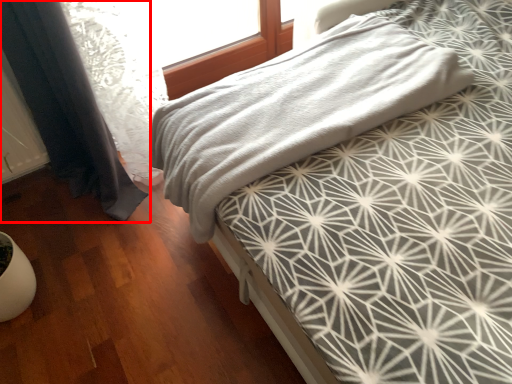
Question: From the image's perspective, what is the correct spatial relationship of curtain (annotated by the red box) in relation to bed?

Choices:
 (A) above
 (B) below

Answer: (B)